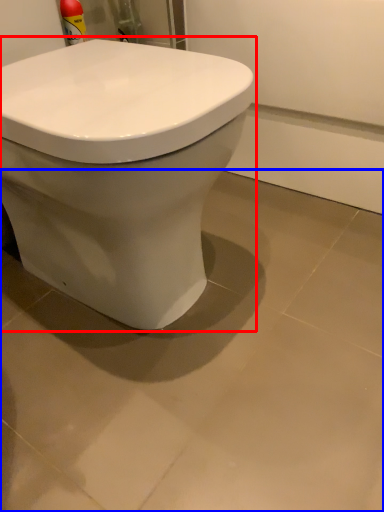
Question: Which of the following is the farthest to the observer, toilet (highlighted by a red box) or ceramic tile (highlighted by a blue box)?

Choices:
 (A) toilet
 (B) ceramic tile

Answer: (B)